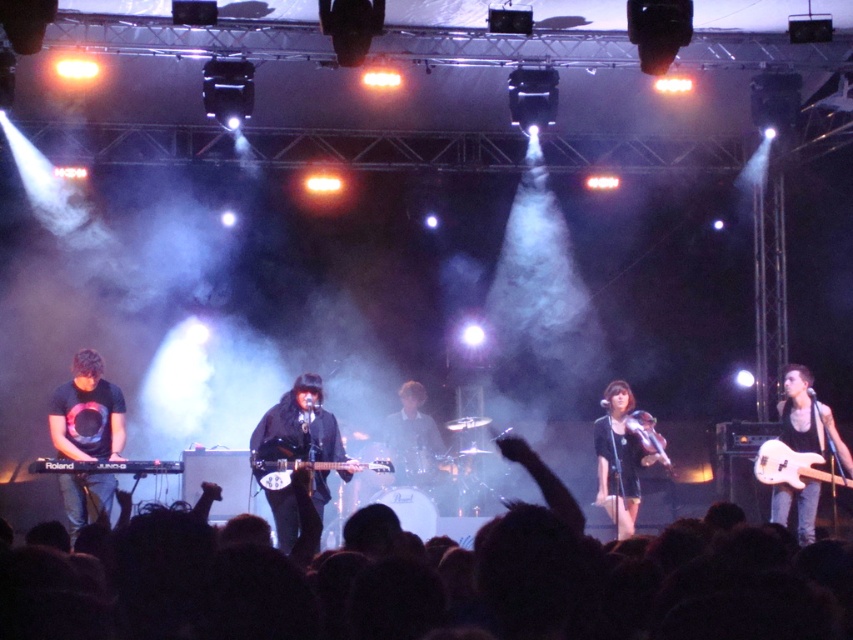
Question: Which point is closer to the camera?

Choices:
 (A) wooden violin at center
 (B) black matte guitar at right
 (C) glossy wood guitar at center

Answer: (C)

Question: Can you confirm if black matte dress at center is positioned to the right of black matte guitar at right?

Choices:
 (A) yes
 (B) no

Answer: (B)

Question: Is white glossy electric guitar at right further to the viewer compared to black matte keyboard at lower left?

Choices:
 (A) no
 (B) yes

Answer: (B)

Question: Does black matte guitar at right have a lesser width compared to wooden violin at center?

Choices:
 (A) yes
 (B) no

Answer: (B)

Question: Which of the following is the farthest from the observer?

Choices:
 (A) black matte guitar at right
 (B) black matte keyboardist at left
 (C) white glossy electric guitar at right

Answer: (A)

Question: Among these points, which one is nearest to the camera?

Choices:
 (A) (257, 456)
 (B) (840, 440)
 (C) (328, 484)
 (D) (631, 486)

Answer: (A)